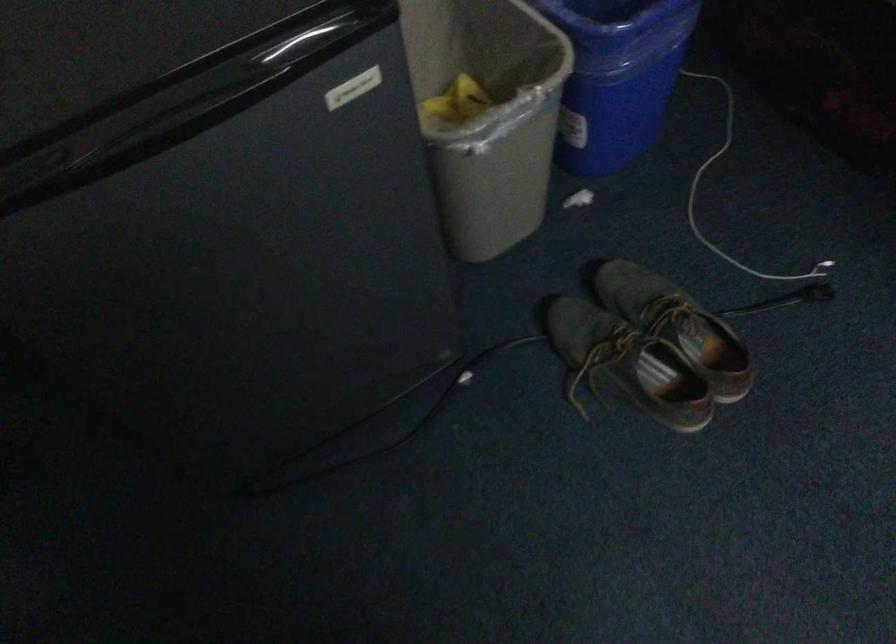
Find where to lift the gray shoe. Please return your answer as a coordinate pair (x, y).

(662, 323)